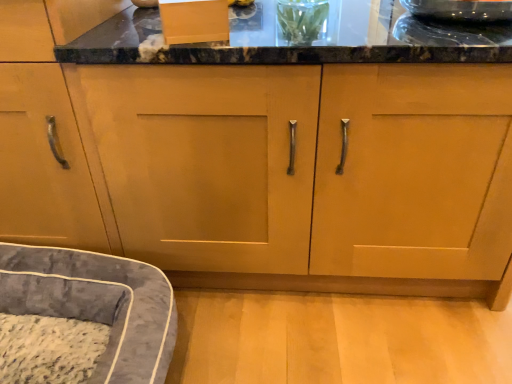
The height and width of the screenshot is (384, 512). What do you see at coordinates (97, 304) in the screenshot? I see `velvet gray dog bed at lower left` at bounding box center [97, 304].

At what (x,y) coordinates should I click in order to perform the action: click on velvet gray dog bed at lower left. Please return your answer as a coordinate pair (x, y). Image resolution: width=512 pixels, height=384 pixels. Looking at the image, I should click on (97, 304).

In order to click on velvet gray dog bed at lower left in this screenshot , I will do pyautogui.click(x=97, y=304).